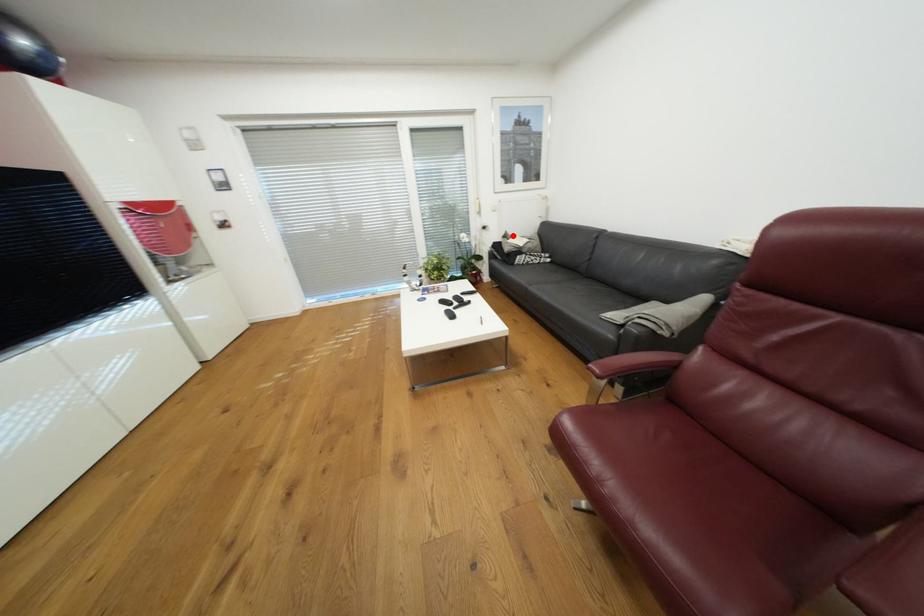
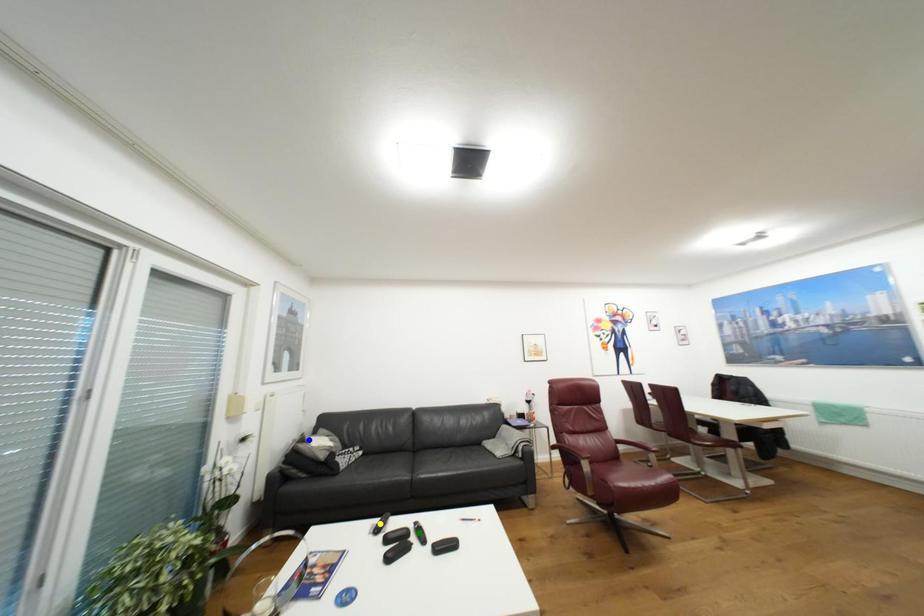
Question: I am providing you with two images of the same scene from different viewpoints. A red point is marked on the first image. You are given multiple points on the second image. Which mark in image 2 goes with the point in image 1?

Choices:
 (A) green point
 (B) yellow point
 (C) blue point

Answer: (C)